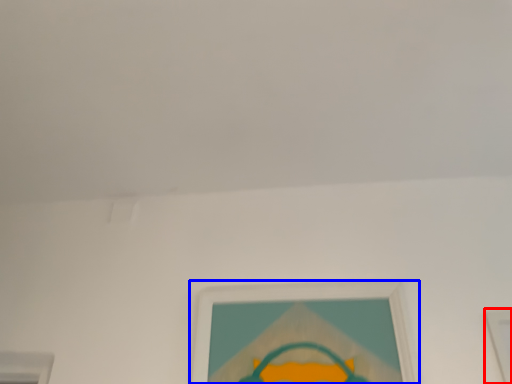
Question: Which object appears farthest to the camera in this image, picture frame (highlighted by a red box) or picture frame (highlighted by a blue box)?

Choices:
 (A) picture frame
 (B) picture frame

Answer: (B)